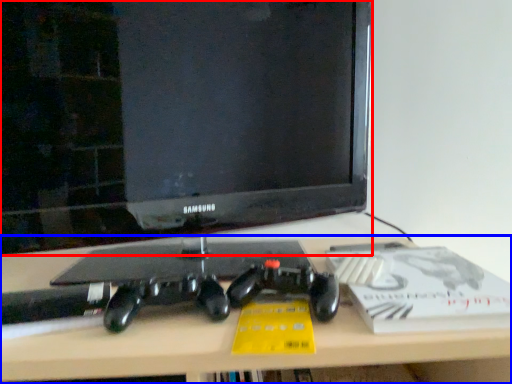
Question: Which of the following is the closest to the observer, television (highlighted by a red box) or desk (highlighted by a blue box)?

Choices:
 (A) television
 (B) desk

Answer: (B)